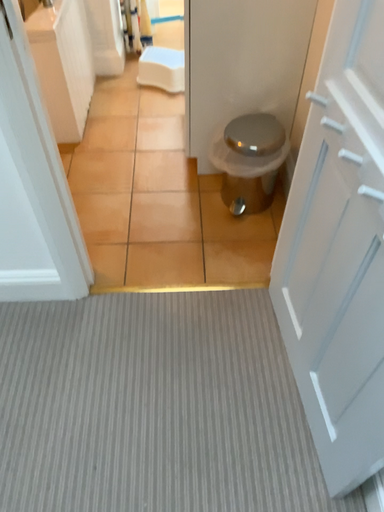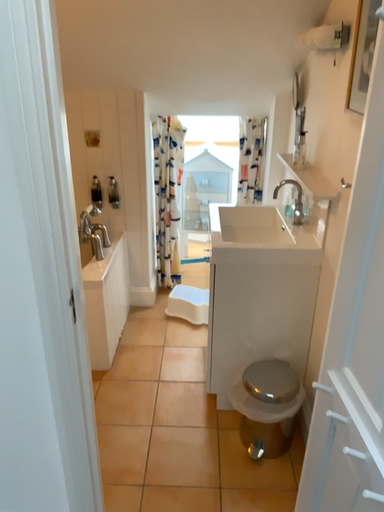
Question: Which way did the camera rotate in the video?

Choices:
 (A) rotated upward
 (B) rotated downward

Answer: (A)